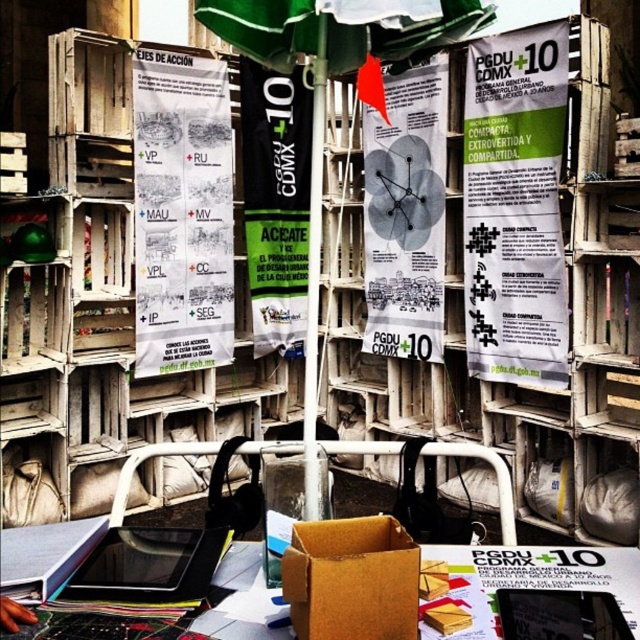
Question: Does white paper poster at upper left have a greater width compared to brown cardboard box at center?

Choices:
 (A) yes
 (B) no

Answer: (A)

Question: Can you confirm if white paper poster at upper right is thinner than white paper poster at center?

Choices:
 (A) no
 (B) yes

Answer: (B)

Question: Which point is closer to the camera?

Choices:
 (A) click(410, 76)
 (B) click(316, 348)
 (C) click(218, 112)

Answer: (B)

Question: Which point is farther from the camera taking this photo?

Choices:
 (A) 545,580
 (B) 253,124

Answer: (B)

Question: Can you confirm if white paper poster at center is thinner than cardboard box at lower center?

Choices:
 (A) no
 (B) yes

Answer: (B)

Question: Which point appears closest to the camera in this image?

Choices:
 (A) tap(150, 86)
 (B) tap(490, 589)
 (C) tap(396, 604)
 (D) tap(412, 189)

Answer: (C)